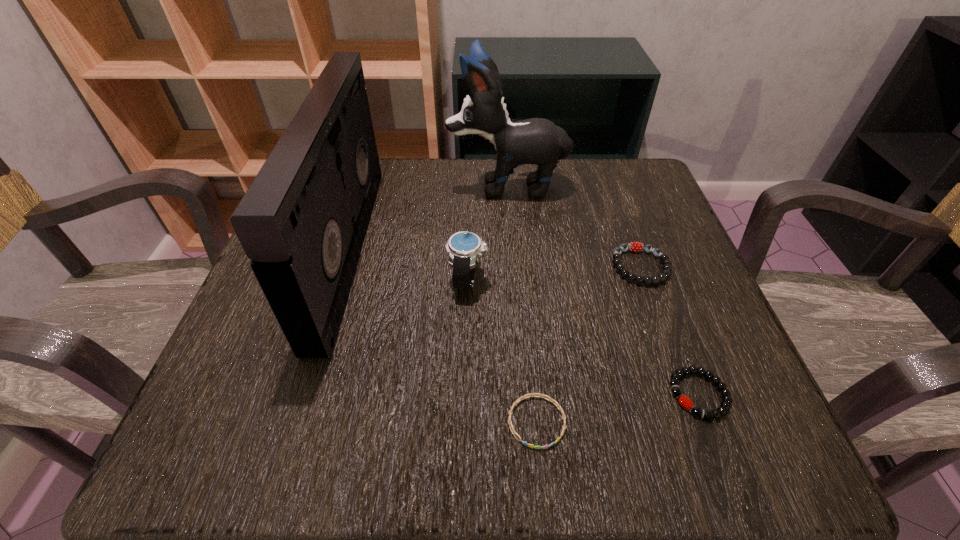
Identify the location of vacant space located on the front-facing side of the puppy. The height and width of the screenshot is (540, 960). (324, 186).

Locate an element on the screen. The height and width of the screenshot is (540, 960). vacant space positioned on the front side of the leftmost object is located at coordinates (449, 250).

Identify the location of blank space located on the front of the third tallest object. (463, 448).

In order to click on vacant area situated 0.160m on the front of the tallest bracelet in this screenshot , I will do `click(676, 363)`.

This screenshot has height=540, width=960. Find the location of `free region located 0.050m on the back of the fifth tallest object`. free region located 0.050m on the back of the fifth tallest object is located at coordinates (679, 342).

The image size is (960, 540). What are the coordinates of `puppy that is at the far edge` in the screenshot? It's located at coord(538,141).

Image resolution: width=960 pixels, height=540 pixels. What are the coordinates of `videotape present at the far edge` in the screenshot? It's located at (302, 222).

Image resolution: width=960 pixels, height=540 pixels. Find the location of `object present at the left edge`. object present at the left edge is located at coordinates (302, 222).

Image resolution: width=960 pixels, height=540 pixels. I want to click on object located in the far left corner section of the desktop, so click(x=302, y=222).

Locate an element on the screen. This screenshot has width=960, height=540. object present at the near right corner is located at coordinates (685, 402).